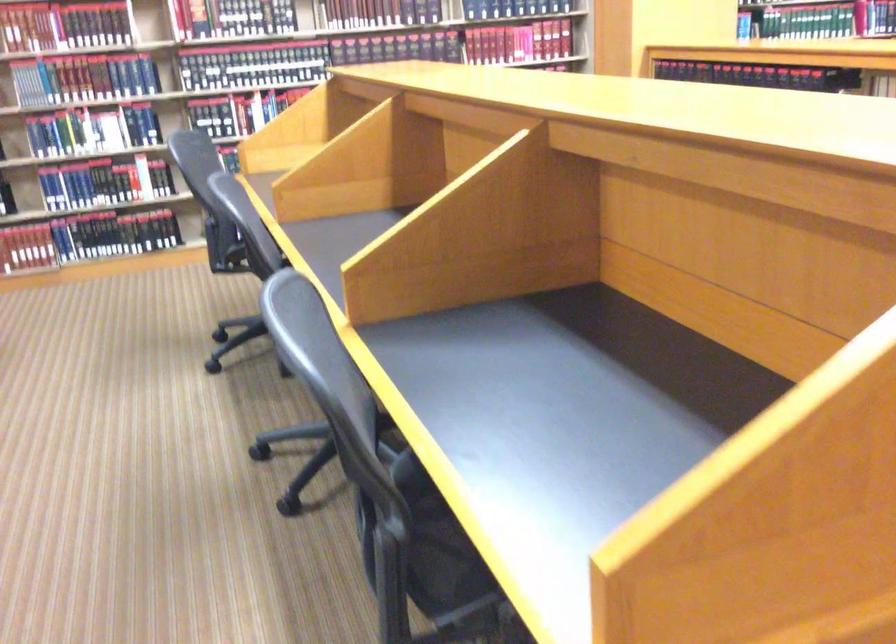
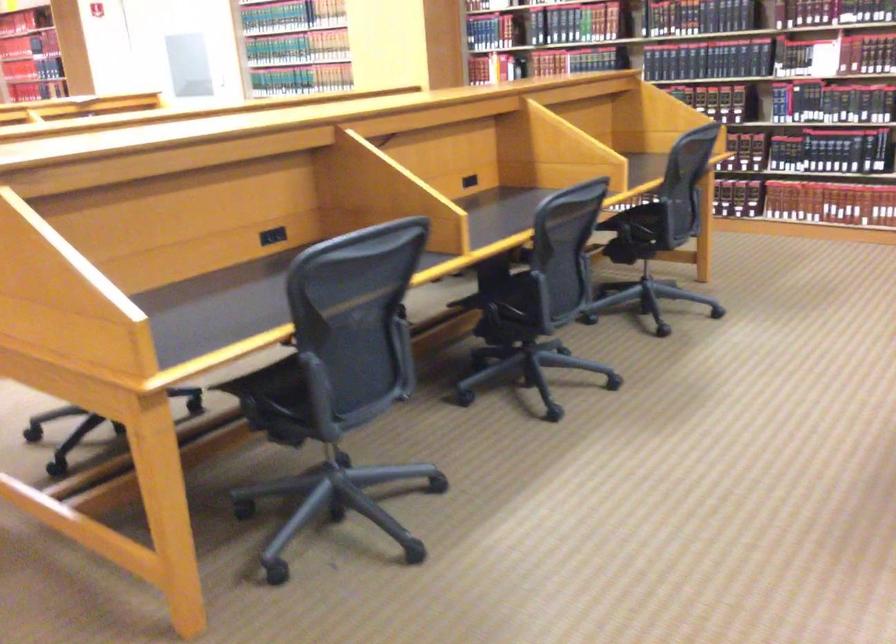
Question: How did the camera likely rotate?

Choices:
 (A) Left
 (B) Right
 (C) Up
 (D) Down

Answer: (A)